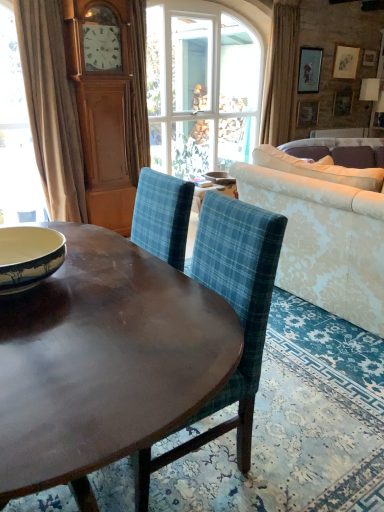
Question: From a real-world perspective, is beige fabric curtain at left, the 1th curtain viewed from the front, under shiny brown wood coffee table at center?

Choices:
 (A) no
 (B) yes

Answer: (A)

Question: Is shiny brown wood coffee table at center a part of beige fabric curtain at left, the first curtain positioned from the left?

Choices:
 (A) no
 (B) yes

Answer: (A)

Question: From the image's perspective, is beige fabric curtain at left, the 1th curtain viewed from the front, beneath shiny brown wood coffee table at center?

Choices:
 (A) yes
 (B) no

Answer: (B)

Question: Are beige fabric curtain at left, the 1th curtain viewed from the front, and shiny brown wood coffee table at center far apart?

Choices:
 (A) no
 (B) yes

Answer: (B)

Question: From the image's perspective, is beige fabric curtain at left, the 1th curtain viewed from the front, over shiny brown wood coffee table at center?

Choices:
 (A) yes
 (B) no

Answer: (A)

Question: Considering the positions of clear glass window at center and white glossy bowl at center, acting as the second bowl starting from the bottom, in the image, is clear glass window at center wider or thinner than white glossy bowl at center, acting as the second bowl starting from the bottom,?

Choices:
 (A) thin
 (B) wide

Answer: (A)

Question: From the image's perspective, is clear glass window at center positioned above or below white glossy bowl at center, which is the 2th bowl in front-to-back order?

Choices:
 (A) above
 (B) below

Answer: (A)

Question: From a real-world perspective, is clear glass window at center above or below white glossy bowl at center, arranged as the 1th bowl when viewed from the top?

Choices:
 (A) above
 (B) below

Answer: (A)

Question: In the image, is clear glass window at center on the left side or the right side of white glossy bowl at center, the 1th bowl viewed from the right?

Choices:
 (A) left
 (B) right

Answer: (A)

Question: Is damask fabric couch at right wider or thinner than wooden picture frame at upper right, which is the 2th picture frame from top to bottom?

Choices:
 (A) wide
 (B) thin

Answer: (A)

Question: From a real-world perspective, is damask fabric couch at right positioned above or below wooden picture frame at upper right, the 1th picture frame from the bottom?

Choices:
 (A) below
 (B) above

Answer: (A)

Question: In the image, is damask fabric couch at right on the left side or the right side of wooden picture frame at upper right, which is the 2th picture frame from top to bottom?

Choices:
 (A) right
 (B) left

Answer: (B)

Question: Considering the positions of point (281, 181) and point (296, 113), is point (281, 181) closer or farther from the camera than point (296, 113)?

Choices:
 (A) farther
 (B) closer

Answer: (B)

Question: Is point (97, 258) closer or farther from the camera than point (302, 114)?

Choices:
 (A) closer
 (B) farther

Answer: (A)

Question: In terms of size, does shiny brown wood coffee table at center appear bigger or smaller than wooden picture frame at upper right, which is the 2th picture frame from top to bottom?

Choices:
 (A) small
 (B) big

Answer: (B)